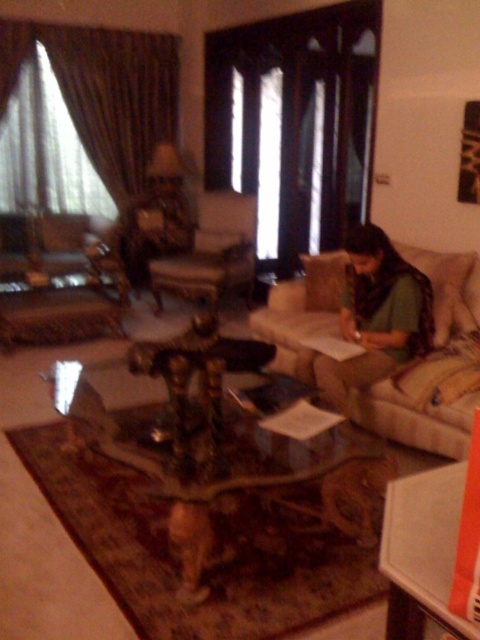
Question: Estimate the real-world distances between objects in this image. Which object is farther from the beige fabric couch at center?

Choices:
 (A) transparent glass table at center
 (B) green fabric person at right

Answer: (A)

Question: Which point is farther from the camera taking this photo?

Choices:
 (A) (342, 504)
 (B) (305, 300)

Answer: (B)

Question: Is transparent glass table at center below green fabric person at right?

Choices:
 (A) yes
 (B) no

Answer: (A)

Question: Where is beige fabric couch at center located in relation to green fabric person at right in the image?

Choices:
 (A) left
 (B) right

Answer: (B)

Question: Where is transparent glass table at center located in relation to green fabric person at right in the image?

Choices:
 (A) below
 (B) above

Answer: (A)

Question: Estimate the real-world distances between objects in this image. Which object is closer to the green fabric person at right?

Choices:
 (A) beige fabric couch at center
 (B) transparent glass table at center

Answer: (A)